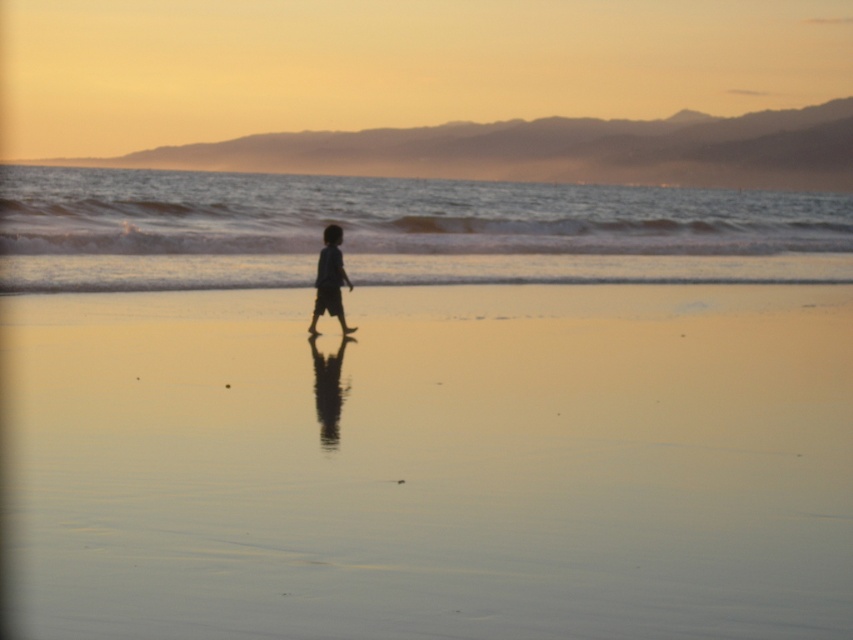
Question: Which object is farther from the camera taking this photo?

Choices:
 (A) clear water at center
 (B) silhouette cotton boy at center
 (C) smooth sand at center

Answer: (A)

Question: In this image, where is smooth sand at center located relative to silhouette cotton boy at center?

Choices:
 (A) below
 (B) above

Answer: (A)

Question: Is clear water at center further to the viewer compared to silhouette cotton boy at center?

Choices:
 (A) no
 (B) yes

Answer: (B)

Question: Based on their relative distances, which object is nearer to the silhouette cotton boy at center?

Choices:
 (A) clear water at center
 (B) smooth sand at center

Answer: (B)

Question: Which point is closer to the camera taking this photo?

Choices:
 (A) (434, 595)
 (B) (335, 260)
 (C) (131, 182)

Answer: (A)

Question: Is smooth sand at center wider than silhouette cotton boy at center?

Choices:
 (A) no
 (B) yes

Answer: (B)